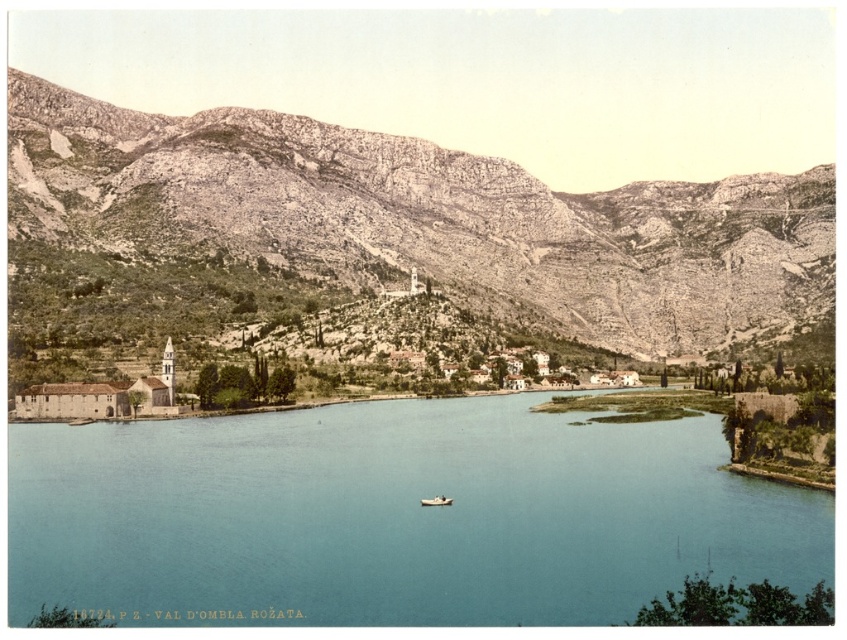
Question: Estimate the real-world distances between objects in this image. Which object is closer to the wooden boat at center?

Choices:
 (A) blue water at center
 (B) rugged stone mountain at center

Answer: (A)

Question: Estimate the real-world distances between objects in this image. Which object is farther from the rugged stone mountain at center?

Choices:
 (A) blue water at center
 (B) wooden boat at center

Answer: (B)

Question: Does blue water at center appear over rugged stone mountain at center?

Choices:
 (A) yes
 (B) no

Answer: (B)

Question: Is blue water at center behind wooden boat at center?

Choices:
 (A) yes
 (B) no

Answer: (B)

Question: Is blue water at center closer to the viewer compared to rugged stone mountain at center?

Choices:
 (A) no
 (B) yes

Answer: (B)

Question: Which of the following is the closest to the observer?

Choices:
 (A) (69, 540)
 (B) (446, 499)
 (C) (475, 198)

Answer: (A)